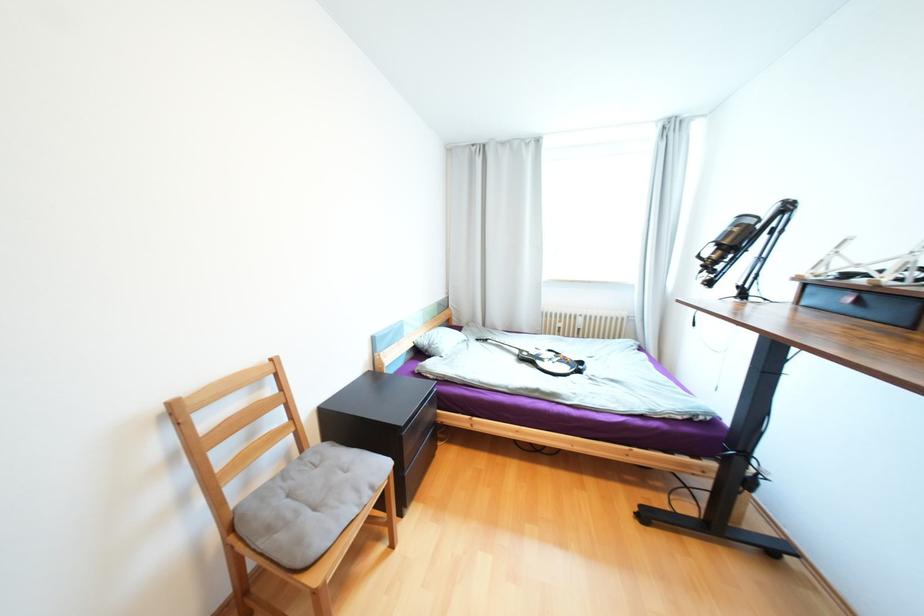
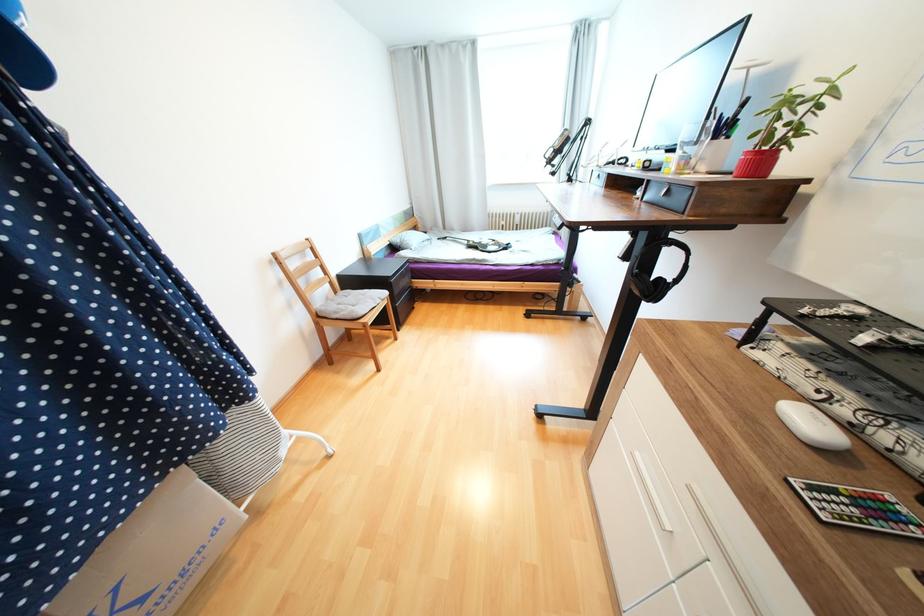
The point at (523,352) is marked in the first image. Where is the corresponding point in the second image?

(471, 243)